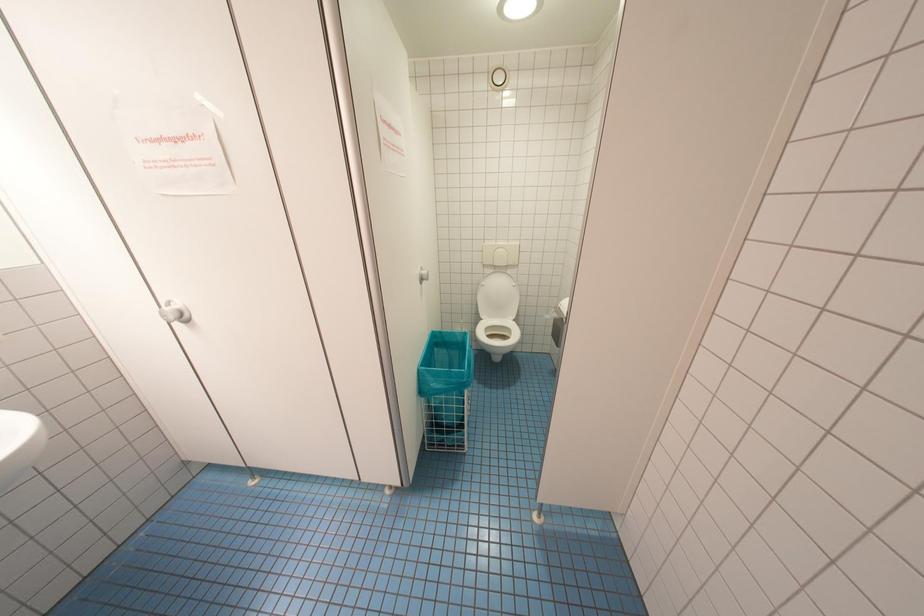
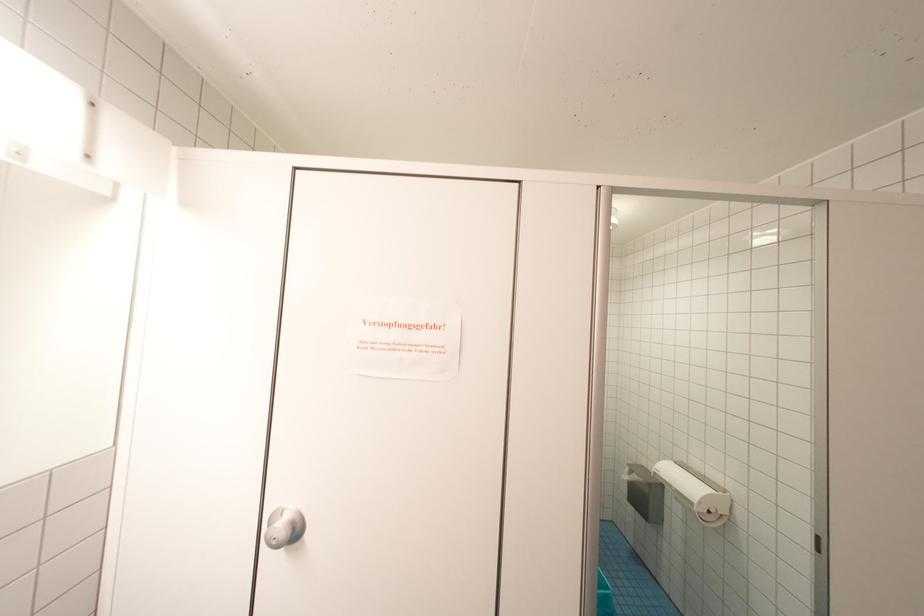
Question: The images are taken continuously from a first-person perspective. In which direction is your viewpoint rotating?

Choices:
 (A) Left
 (B) Right
 (C) Up
 (D) Down

Answer: (C)